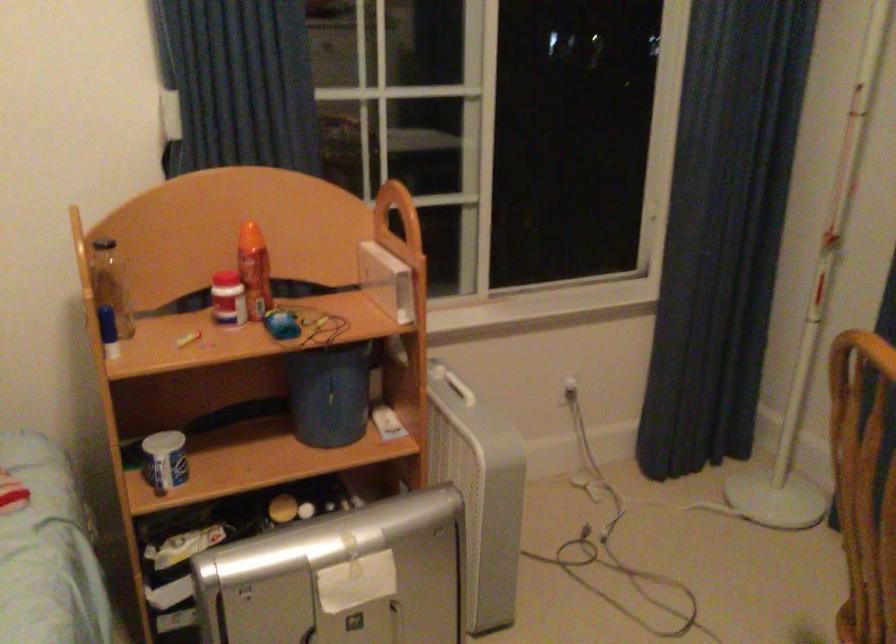
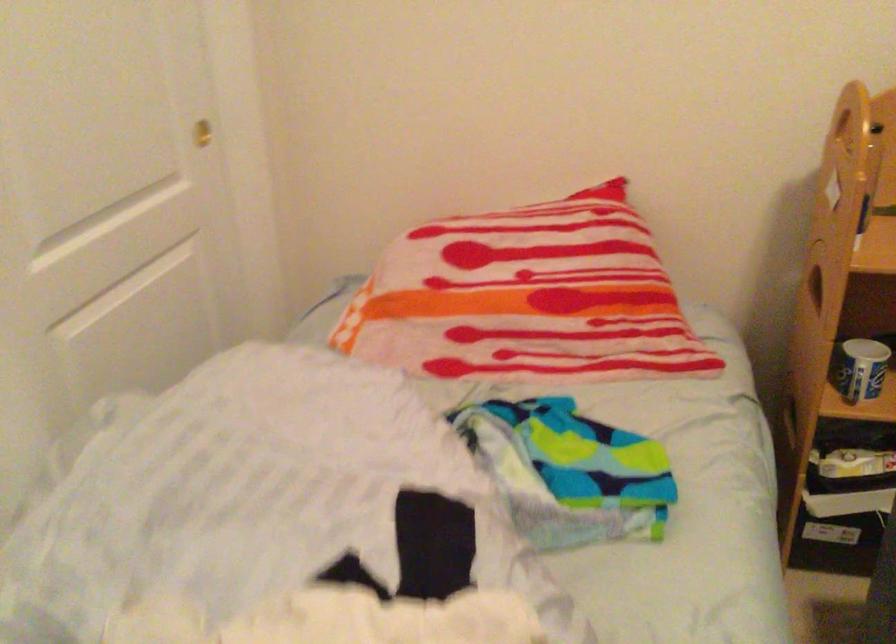
Question: How did the camera likely rotate?

Choices:
 (A) Left
 (B) Right
 (C) Up
 (D) Down

Answer: (A)